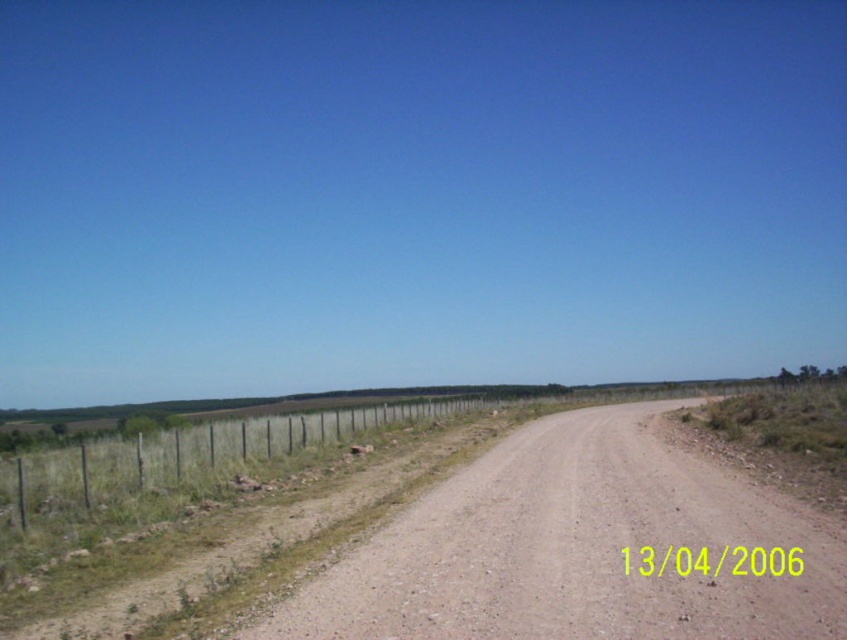
You are a photographer planning to capture a landscape shot of the brown gravel dirt track at center and the metal wire fence at left. Which object appears lower in the image?

The brown gravel dirt track at center appears lower in the image because it has a lesser height compared to the metal wire fence at left.

You are standing at the starting point of the dirt road and want to reach the distant trees on the horizon. The point marked as point (579, 547) shows the brown gravel dirt track at center. Which direction should you follow the brown gravel dirt track at center to reach the distant trees on the horizon?

The brown gravel dirt track at center extends towards the distant trees on the horizon, so you should follow it in the direction it is pointing to reach the distant trees on the horizon.